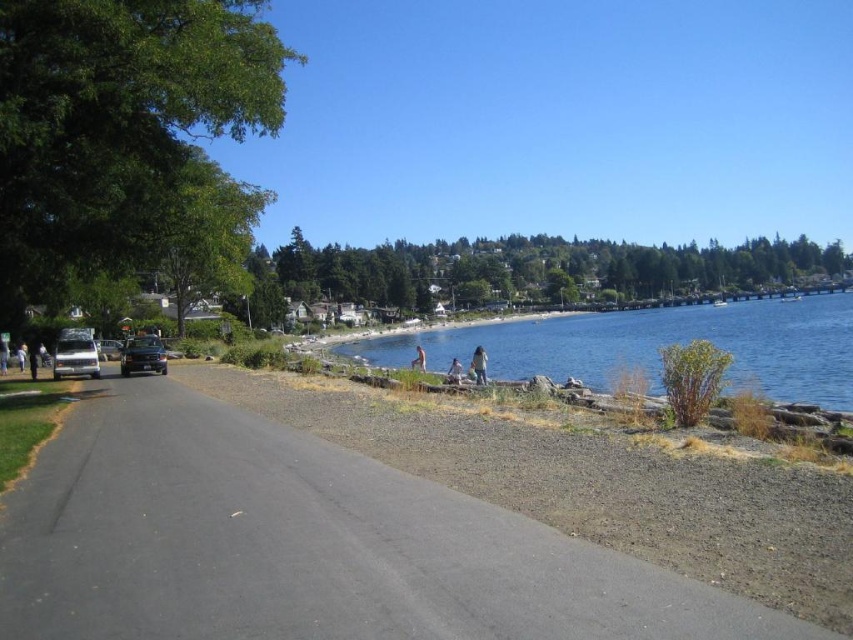
You are a photographer planning to take a picture of the blue water at center and the satin black car at left. Based on their positions, which object will appear larger in the photo?

Result: The blue water at center will appear larger in the photo because it is much taller than the satin black car at left.

You are a photographer standing at the lakeside. You want to take a photo that includes both the light brown wooden bench at center and the skinny nude person at center. Which object should you adjust to ensure both are in the frame?

The light brown wooden bench at center is above the skinny nude person at center, so you should lower the angle of your camera to include both objects in the frame.

You are standing at the edge of the lake and want to locate the blue water at center. According to the coordinates provided, in which direction should you look relative to your position?

The blue water at center is located at coordinates point (654, 346). Since the coordinate system is not specified, it is recommended to look towards the center of the image where the blue water is situated.